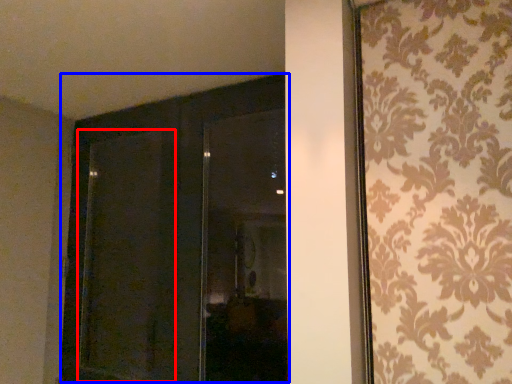
Question: Which object appears closest to the camera in this image, screen door (highlighted by a red box) or door (highlighted by a blue box)?

Choices:
 (A) screen door
 (B) door

Answer: (B)